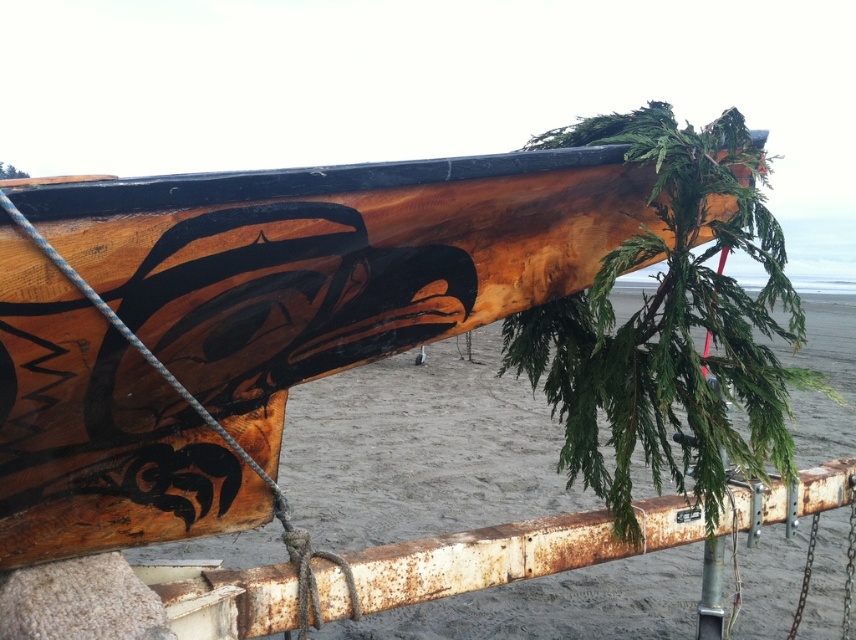
Question: Does wooden canoe at center have a greater width compared to rusty metal rail at lower center?

Choices:
 (A) yes
 (B) no

Answer: (B)

Question: Does wooden canoe at center have a greater width compared to rusty metal rail at lower center?

Choices:
 (A) no
 (B) yes

Answer: (A)

Question: Which of the following is the farthest from the observer?

Choices:
 (A) rusty metal rail at lower center
 (B) wooden canoe at center

Answer: (A)

Question: Which point appears closest to the camera in this image?

Choices:
 (A) (643, 173)
 (B) (688, 541)

Answer: (A)

Question: Can you confirm if wooden canoe at center is positioned to the left of rusty metal rail at lower center?

Choices:
 (A) yes
 (B) no

Answer: (A)